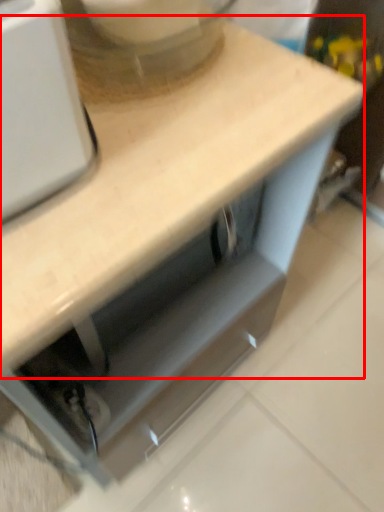
Question: In this image, where is countertop (annotated by the red box) located relative to mixer?

Choices:
 (A) right
 (B) left

Answer: (B)